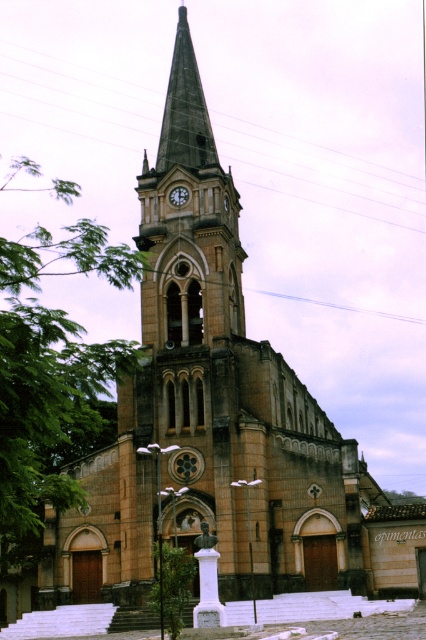
Between point (23, 356) and point (184, 204), which one is positioned in front?

Point (23, 356) is in front.

Does green leafy tree at left have a lesser height compared to matte stone clock at center?

Result: No.

Is point (40, 392) farther from camera compared to point (181, 193)?

No, it is in front of (181, 193).

The image size is (426, 640). What are the coordinates of `green leafy tree at left` in the screenshot? It's located at pyautogui.click(x=52, y=374).